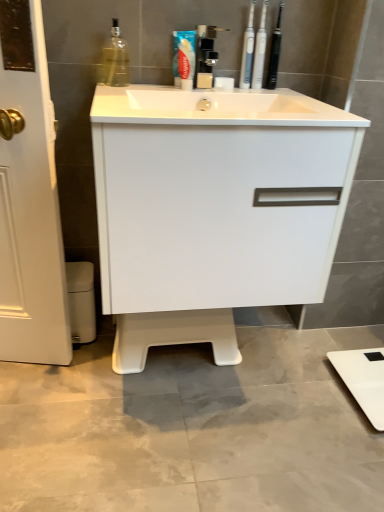
Locate an element on the screen. This screenshot has height=512, width=384. free location to the right of satin nickel faucet at upper center is located at coordinates (249, 98).